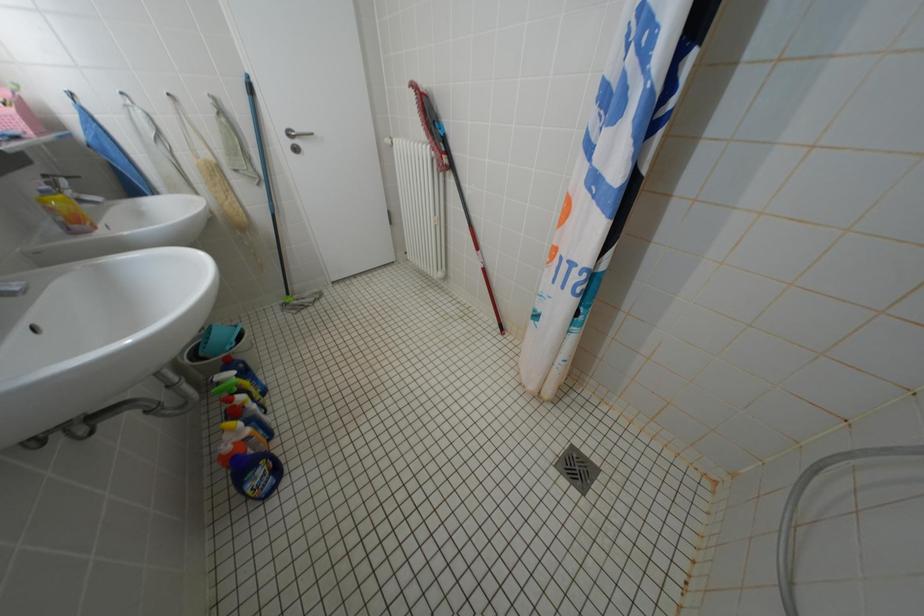
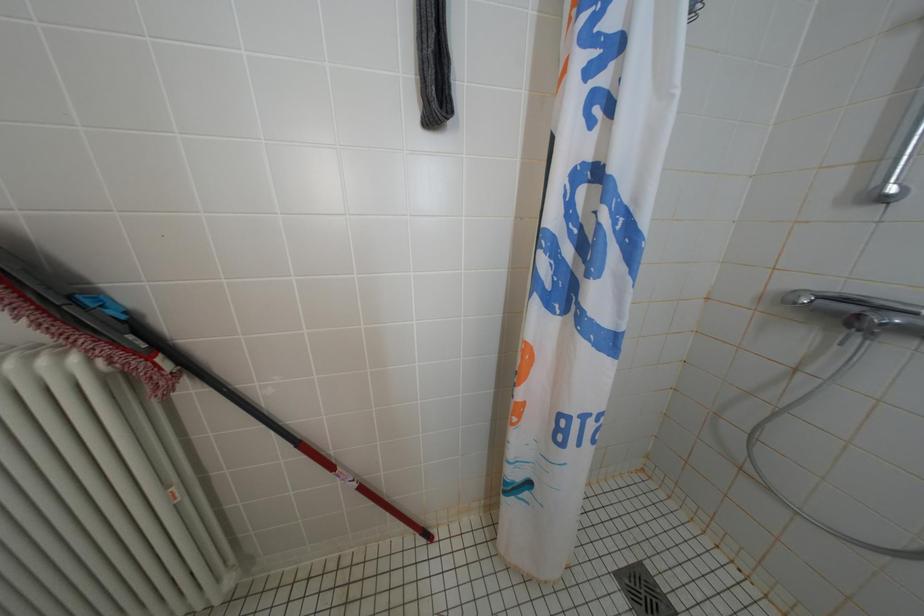
Question: The first image is from the beginning of the video and the second image is from the end. How did the camera likely rotate when shooting the video?

Choices:
 (A) Left
 (B) Right
 (C) Up
 (D) Down

Answer: (B)